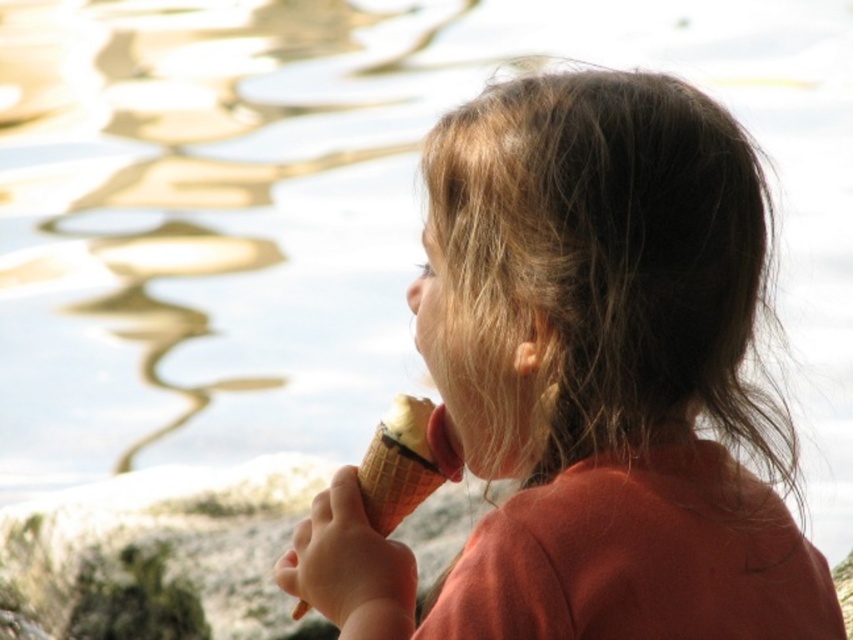
You are a photographer trying to capture the child and their ice cream cone without any obstructions. Based on the scene, will the smooth gray rock at lower left block the view of the vanilla ice cream in waffle cone at lower center?

The vanilla ice cream in waffle cone at lower center is behind the smooth gray rock at lower left, so the rock will block the view of the ice cream cone.

You are a photographer trying to capture the matte brown ice cream cone at center and the smooth gray rock at lower left in the same frame. Based on their positions, which object should you focus on first to ensure both are in the shot?

The smooth gray rock at lower left should be focused on first since the matte brown ice cream cone at center is positioned to its right, meaning adjusting the frame to include the rock on the left will naturally include the cone on the right.

You are a photographer trying to capture the perfect shot of the child and their ice cream. The camera requires a minimum distance of 8 inches between the two main subjects to focus properly. Given the current positioning of the matte brown ice cream cone at center and the vanilla ice cream in waffle cone at lower center, will the camera be able to focus on both subjects clearly?

The matte brown ice cream cone at center is 9.11 inches from the vanilla ice cream in waffle cone at lower center. Since this distance exceeds the camera requirement of 8 inches, the camera can focus on both subjects clearly.